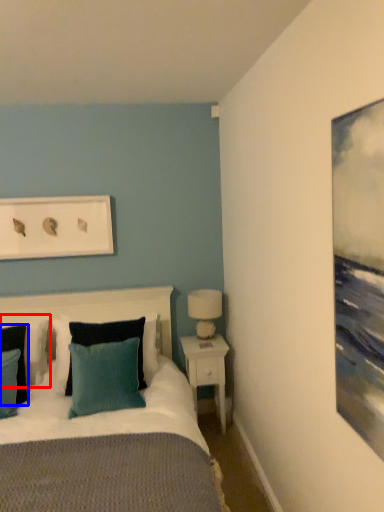
Question: Which object is closer to the camera taking this photo, pillow (highlighted by a red box) or pillow (highlighted by a blue box)?

Choices:
 (A) pillow
 (B) pillow

Answer: (B)